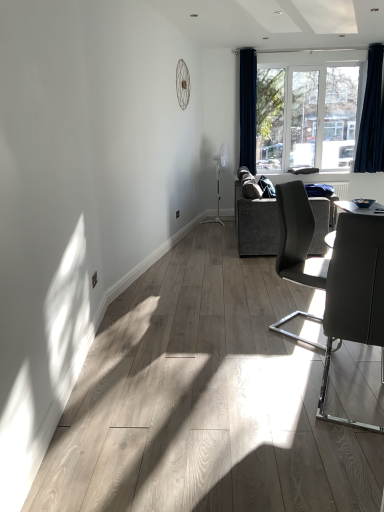
Where is `vacant space behind matte gray chair at right, the second chair when ordered from back to front`? The height and width of the screenshot is (512, 384). vacant space behind matte gray chair at right, the second chair when ordered from back to front is located at coordinates (291, 356).